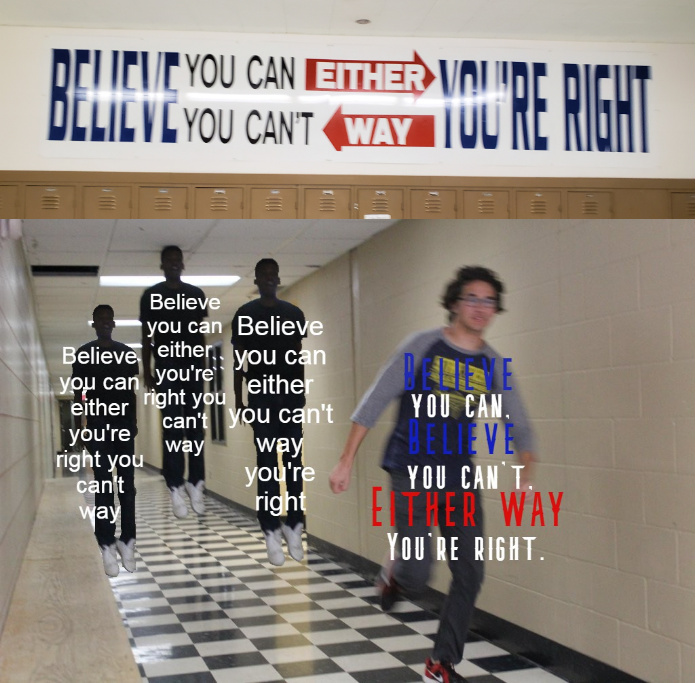
Identify the location of ceiling lights. The height and width of the screenshot is (683, 696). (140, 359), (134, 343), (129, 320), (127, 277).